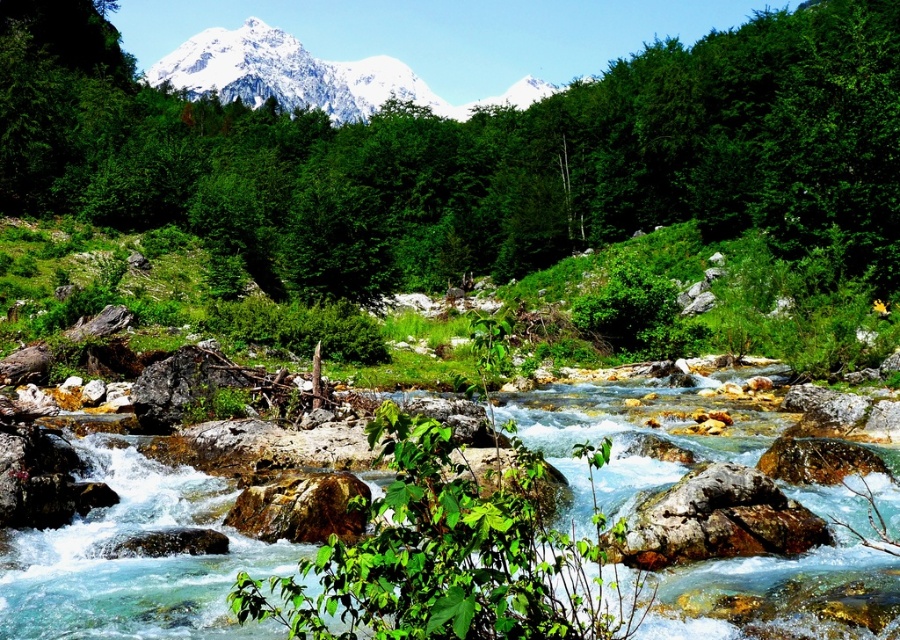
How far apart are green leafy tree at center and snowy white mountain at upper center?

green leafy tree at center and snowy white mountain at upper center are 183.61 meters apart.

Between green leafy tree at center and snowy white mountain at upper center, which one has less height?

With less height is green leafy tree at center.

Locate an element on the screen. This screenshot has width=900, height=640. green leafy tree at center is located at coordinates (472, 157).

Which is above, green leafy tree at center or rusty metallic boulder at center-right?

green leafy tree at center is higher up.

Can you confirm if green leafy tree at center is positioned below rusty metallic boulder at center-right?

No, green leafy tree at center is not below rusty metallic boulder at center-right.

Is point (597, 237) less distant than point (630, 518)?

No, it is not.

Find the location of `green leafy tree at center`. green leafy tree at center is located at coordinates (472, 157).

Is snowy white mountain at upper center shorter than rusty metallic boulder at center-right?

No, snowy white mountain at upper center is not shorter than rusty metallic boulder at center-right.

Between snowy white mountain at upper center and rusty metallic boulder at center-right, which one is positioned higher?

Positioned higher is snowy white mountain at upper center.

Does point (318, 68) come behind point (726, 554)?

Yes.

Where is `snowy white mountain at upper center`? snowy white mountain at upper center is located at coordinates (309, 76).